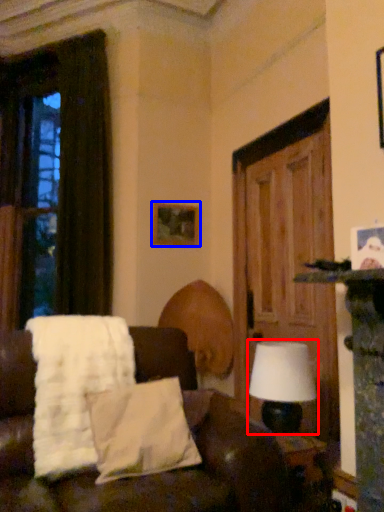
Question: Among these objects, which one is farthest to the camera, table lamp (highlighted by a red box) or picture frame (highlighted by a blue box)?

Choices:
 (A) table lamp
 (B) picture frame

Answer: (B)